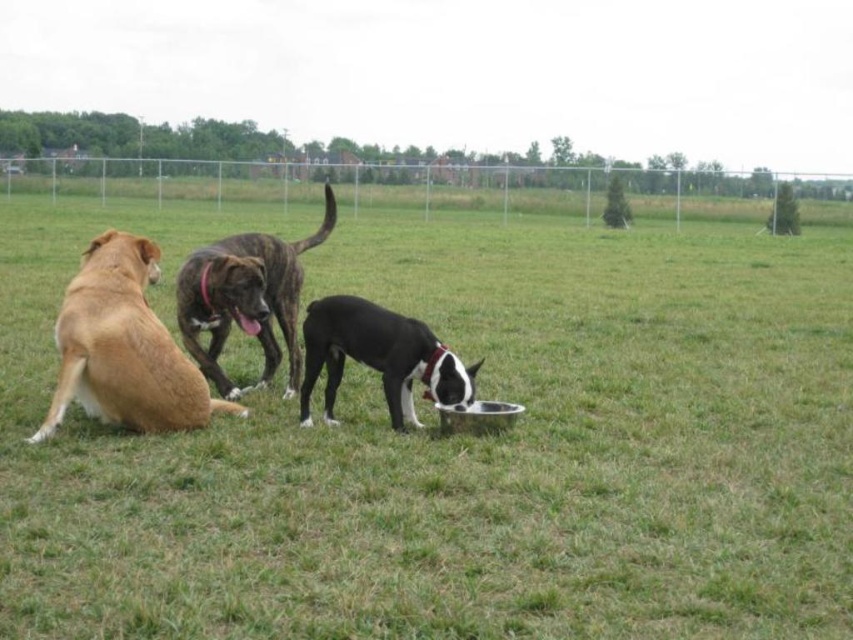
Question: Is green grass at center further to camera compared to black matte dog at center?

Choices:
 (A) yes
 (B) no

Answer: (B)

Question: Does golden fur dog at left appear on the left side of black matte dog at center?

Choices:
 (A) yes
 (B) no

Answer: (A)

Question: Among these points, which one is farthest from the camera?

Choices:
 (A) (279, 291)
 (B) (585, 541)
 (C) (390, 317)

Answer: (A)

Question: Which of the following is the farthest from the observer?

Choices:
 (A) black matte dog at center
 (B) brindle fur dog at center
 (C) green grass at center

Answer: (B)

Question: Can you confirm if green grass at center is wider than brindle fur dog at center?

Choices:
 (A) yes
 (B) no

Answer: (A)

Question: Which point is farther from the camera taking this photo?

Choices:
 (A) (80, 289)
 (B) (749, 385)
 (C) (248, 273)

Answer: (B)